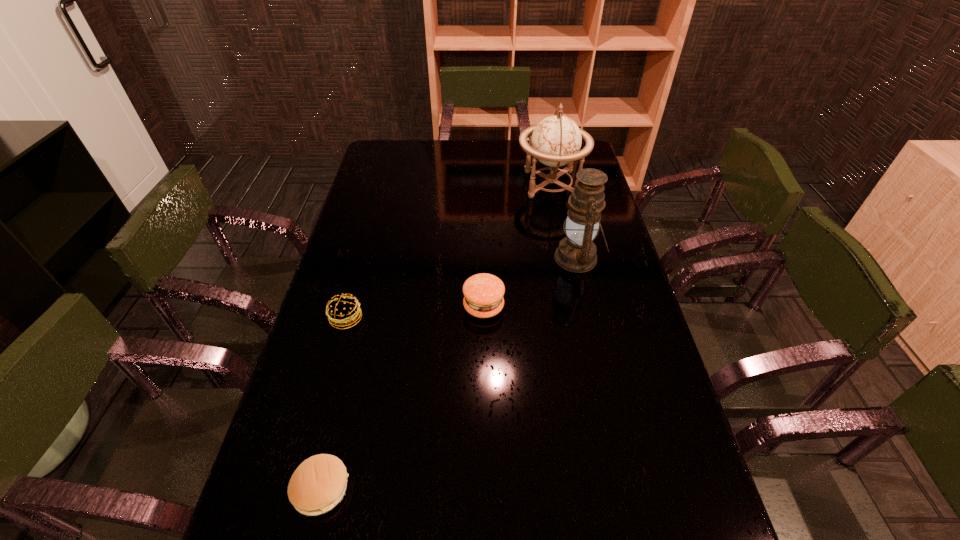
At what (x,y) coordinates should I click in order to perform the action: click on vacant region at the right edge. Please return your answer as a coordinate pair (x, y). Looking at the image, I should click on (588, 306).

At what (x,y) coordinates should I click in order to perform the action: click on vacant area that lies between the second shortest patty and the tallest patty. Please return your answer as a coordinate pair (x, y). This screenshot has width=960, height=540. Looking at the image, I should click on (415, 312).

Identify the location of vacant area that lies between the rightmost patty and the second shortest patty. (415, 312).

At what (x,y) coordinates should I click in order to perform the action: click on free space between the second shortest object and the second farthest object. Please return your answer as a coordinate pair (x, y). The image size is (960, 540). Looking at the image, I should click on (462, 288).

In order to click on vacant space in between the third shortest object and the oil lamp in this screenshot , I will do `click(531, 282)`.

You are a GUI agent. You are given a task and a screenshot of the screen. Output one action in this format:
    pyautogui.click(x=<x>, y=<y>)
    Task: Click on the unoccupied area between the oil lamp and the globe
    
    Given the screenshot: What is the action you would take?
    pyautogui.click(x=564, y=221)

Where is `free space between the farthest object and the oil lamp`? This screenshot has height=540, width=960. free space between the farthest object and the oil lamp is located at coordinates (564, 221).

Where is `free space between the third shortest object and the nearest object`? free space between the third shortest object and the nearest object is located at coordinates (402, 397).

Identify the location of vacant space in between the shortest object and the third tallest object. (402, 397).

This screenshot has width=960, height=540. I want to click on vacant space that's between the globe and the fourth nearest object, so click(564, 221).